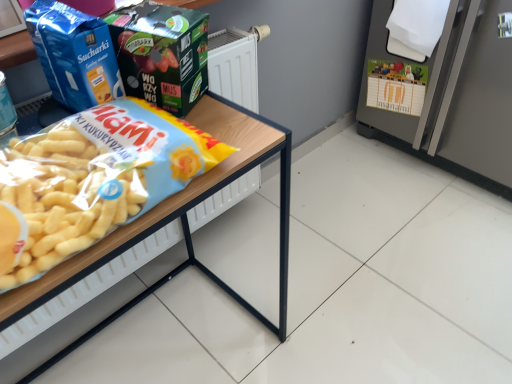
Question: Should I look upward or downward to see satin silver refrigerator at right?

Choices:
 (A) down
 (B) up

Answer: (B)

Question: From the image's perspective, is satin silver refrigerator at right above matte green box at upper center, the second product in the left-to-right sequence?

Choices:
 (A) no
 (B) yes

Answer: (B)

Question: Considering the relative sizes of satin silver refrigerator at right and matte green box at upper center, which is the first product from right to left, in the image provided, is satin silver refrigerator at right thinner than matte green box at upper center, which is the first product from right to left,?

Choices:
 (A) no
 (B) yes

Answer: (A)

Question: Is satin silver refrigerator at right closer to the viewer compared to matte green box at upper center, which is the first product from right to left?

Choices:
 (A) no
 (B) yes

Answer: (A)

Question: From the image's perspective, is satin silver refrigerator at right beneath matte green box at upper center, which is the first product from right to left?

Choices:
 (A) yes
 (B) no

Answer: (B)

Question: From a real-world perspective, is satin silver refrigerator at right over matte green box at upper center, which is the first product from right to left?

Choices:
 (A) no
 (B) yes

Answer: (A)

Question: Is satin silver refrigerator at right turned away from matte green box at upper center, the second product in the left-to-right sequence?

Choices:
 (A) no
 (B) yes

Answer: (A)

Question: Can we say wooden table at left lies outside blue matte bag at upper left, placed as the first product when sorted from left to right?

Choices:
 (A) yes
 (B) no

Answer: (A)

Question: Considering the relative sizes of wooden table at left and blue matte bag at upper left, placed as the first product when sorted from left to right, in the image provided, is wooden table at left wider than blue matte bag at upper left, placed as the first product when sorted from left to right,?

Choices:
 (A) yes
 (B) no

Answer: (A)

Question: Does wooden table at left have a larger size compared to blue matte bag at upper left, placed as the first product when sorted from left to right?

Choices:
 (A) yes
 (B) no

Answer: (A)

Question: Is blue matte bag at upper left, placed as the first product when sorted from left to right, located within wooden table at left?

Choices:
 (A) no
 (B) yes

Answer: (A)

Question: Is wooden table at left at the left side of blue matte bag at upper left, placed as the first product when sorted from left to right?

Choices:
 (A) yes
 (B) no

Answer: (B)

Question: From a real-world perspective, is wooden table at left under blue matte bag at upper left, positioned as the second product in right-to-left order?

Choices:
 (A) yes
 (B) no

Answer: (A)

Question: Can you confirm if matte green box at upper center, the second product in the left-to-right sequence, is taller than satin silver refrigerator at right?

Choices:
 (A) no
 (B) yes

Answer: (A)